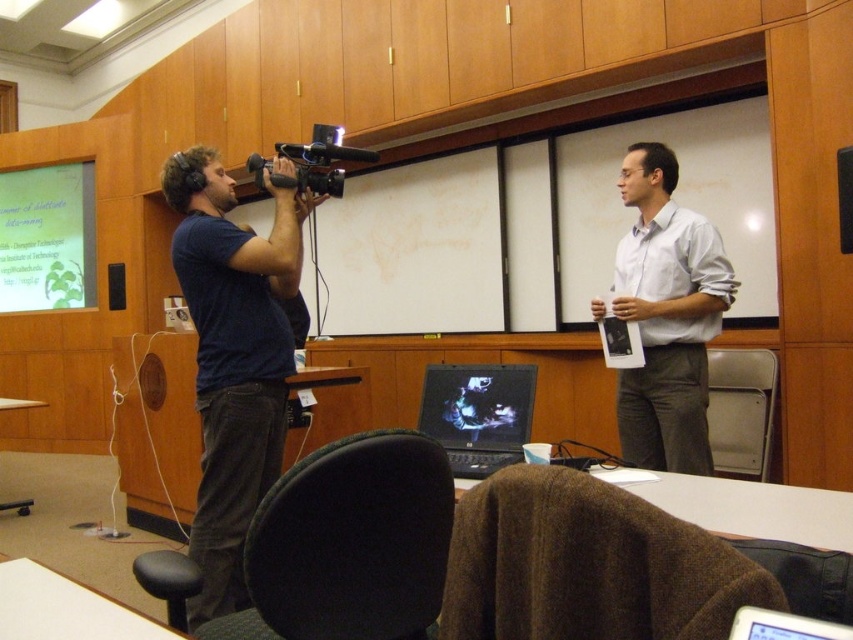
Does green matte projection screen at upper left come in front of black glossy laptop at center?

That is False.

This screenshot has height=640, width=853. Describe the element at coordinates (47, 237) in the screenshot. I see `green matte projection screen at upper left` at that location.

Find the location of a particular element. The height and width of the screenshot is (640, 853). green matte projection screen at upper left is located at coordinates click(x=47, y=237).

The height and width of the screenshot is (640, 853). What do you see at coordinates (666, 316) in the screenshot?
I see `white matte shirt at center` at bounding box center [666, 316].

Is white matte shirt at center thinner than green matte projection screen at upper left?

Yes, white matte shirt at center is thinner than green matte projection screen at upper left.

Where is `white matte shirt at center`? Image resolution: width=853 pixels, height=640 pixels. white matte shirt at center is located at coordinates (666, 316).

Who is more forward, (271, 349) or (660, 211)?

Point (271, 349) is more forward.

Can you confirm if dark blue t-shirt at left is wider than white matte shirt at center?

Yes, dark blue t-shirt at left is wider than white matte shirt at center.

The image size is (853, 640). Describe the element at coordinates (233, 358) in the screenshot. I see `dark blue t-shirt at left` at that location.

This screenshot has height=640, width=853. In order to click on dark blue t-shirt at left in this screenshot , I will do `click(233, 358)`.